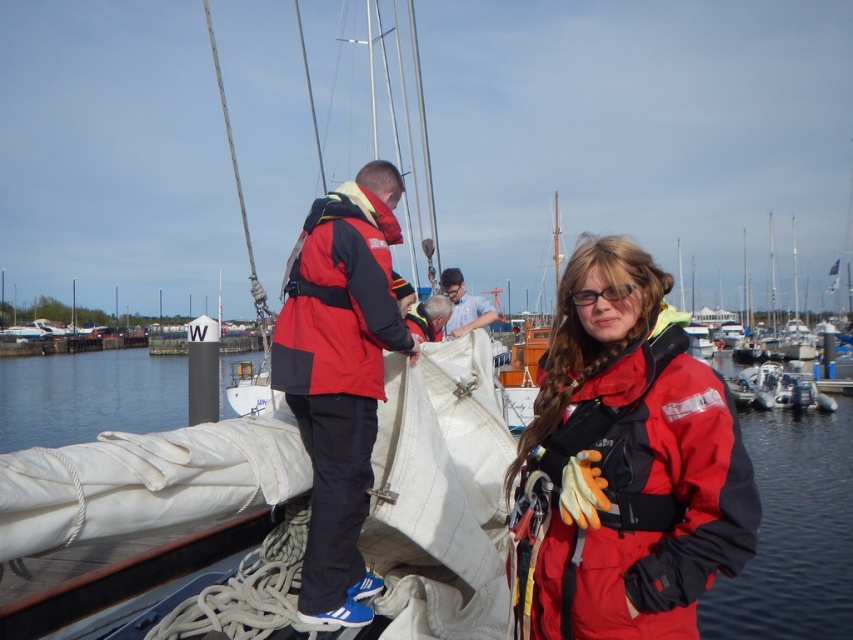
Is point (126, 424) positioned behind point (386, 317)?

Yes.

Can you confirm if white fabric at center is shorter than red matte life jacket at center?

In fact, white fabric at center may be taller than red matte life jacket at center.

Describe the element at coordinates (793, 532) in the screenshot. I see `white fabric at center` at that location.

Find the location of a particular element. The height and width of the screenshot is (640, 853). white fabric at center is located at coordinates (793, 532).

Is matte red jacket at center closer to the viewer compared to red matte jacket at center?

Yes, matte red jacket at center is closer to the viewer.

Is point (686, 605) positioned behind point (363, 509)?

That is False.

Where is `matte red jacket at center`? Image resolution: width=853 pixels, height=640 pixels. matte red jacket at center is located at coordinates (625, 464).

Between matte red jacket at center and red matte life jacket at center, which one appears on the right side from the viewer's perspective?

From the viewer's perspective, matte red jacket at center appears more on the right side.

Is point (608, 413) positioned in front of point (341, 314)?

Yes, it is in front of point (341, 314).

Image resolution: width=853 pixels, height=640 pixels. Describe the element at coordinates (625, 464) in the screenshot. I see `matte red jacket at center` at that location.

Locate an element on the screen. matte red jacket at center is located at coordinates (625, 464).